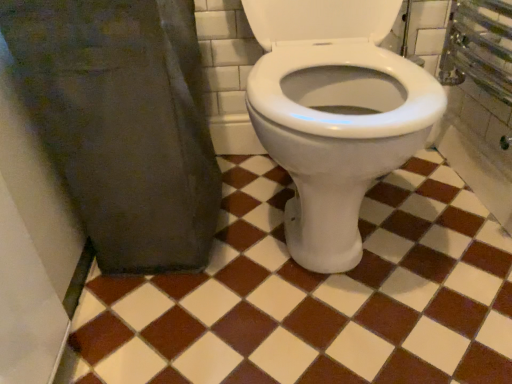
This screenshot has width=512, height=384. Find the location of `brown glossy tile at center`. brown glossy tile at center is located at coordinates (316, 295).

What do you see at coordinates (316, 295) in the screenshot? I see `brown glossy tile at center` at bounding box center [316, 295].

In order to click on brown glossy tile at center in this screenshot , I will do `click(316, 295)`.